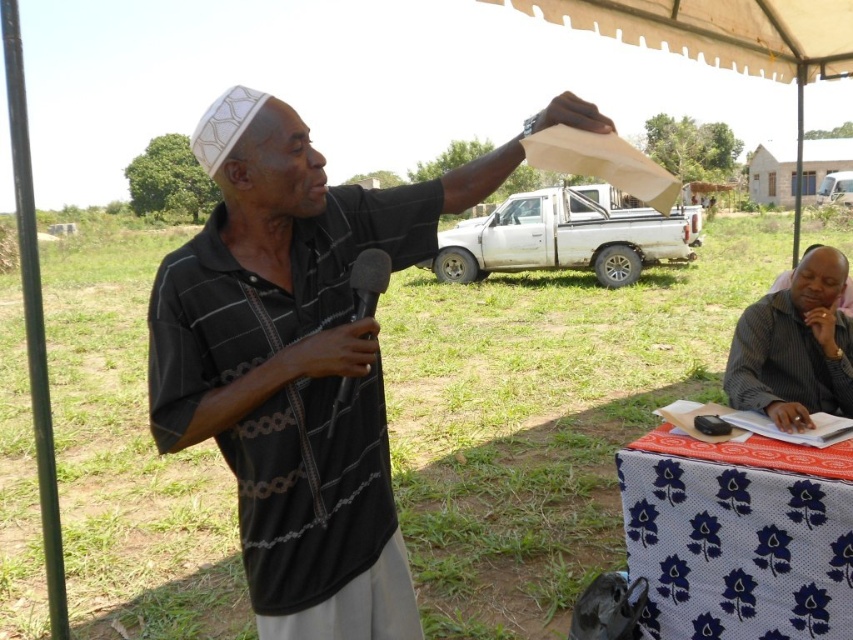
Based on the photo, you are a photographer positioned to take a photo of the speaker under the canopy tent. You notice the dark gray shirt at lower right and the black matte microphone at center. Which object should you focus on first to ensure both are in the frame?

You should focus on the dark gray shirt at lower right first because the black matte microphone at center is behind it, so adjusting the focus starting from the foreground object ensures both are in the frame.